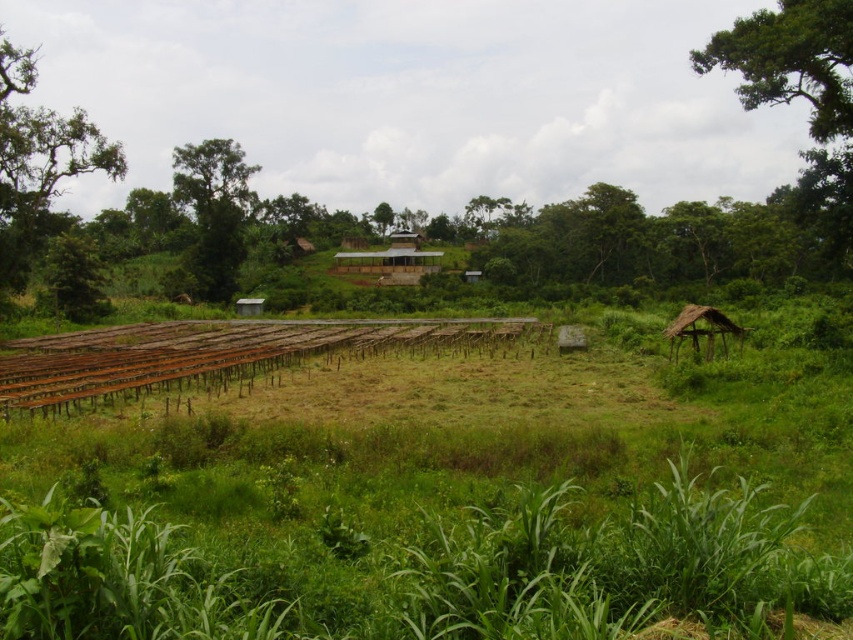
Is point (357, 349) positioned behind point (181, 196)?

No, (357, 349) is in front of (181, 196).

Can you confirm if rusty metal train track at center is positioned to the left of green leafy tree at upper left?

No, rusty metal train track at center is not to the left of green leafy tree at upper left.

Is point (486, 339) less distant than point (236, 173)?

Yes, point (486, 339) is closer to viewer.

Where is `rusty metal train track at center`? Image resolution: width=853 pixels, height=640 pixels. rusty metal train track at center is located at coordinates (210, 352).

In the scene shown: Is rusty metal train track at center behind green leafy tree at upper right?

No, it is not.

Does rusty metal train track at center lie in front of green leafy tree at upper right?

That is True.

Who is more distant from viewer, (38, 387) or (782, 58)?

Point (782, 58)

Locate an element on the screen. This screenshot has width=853, height=640. rusty metal train track at center is located at coordinates (210, 352).

Does green leafy tree at left have a larger size compared to green leafy tree at upper left?

Actually, green leafy tree at left might be smaller than green leafy tree at upper left.

Does green leafy tree at left appear on the right side of green leafy tree at upper left?

Indeed, green leafy tree at left is positioned on the right side of green leafy tree at upper left.

Where is `green leafy tree at left`? green leafy tree at left is located at coordinates (38, 163).